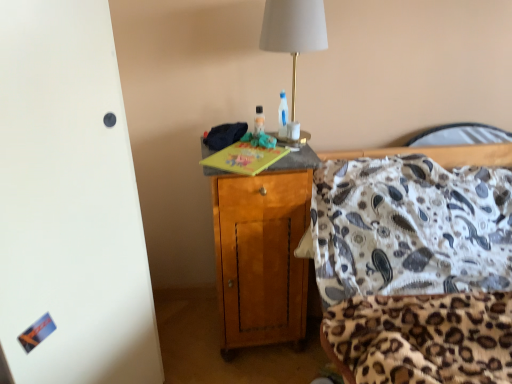
Question: From the image's perspective, would you say translucent plastic bottle at center is shown under white fabric lampshade at upper center?

Choices:
 (A) no
 (B) yes

Answer: (B)

Question: Is translucent plastic bottle at center far from white fabric lampshade at upper center?

Choices:
 (A) no
 (B) yes

Answer: (A)

Question: Does translucent plastic bottle at center have a greater width compared to white fabric lampshade at upper center?

Choices:
 (A) yes
 (B) no

Answer: (B)

Question: Considering the relative sizes of translucent plastic bottle at center and white fabric lampshade at upper center in the image provided, is translucent plastic bottle at center shorter than white fabric lampshade at upper center?

Choices:
 (A) no
 (B) yes

Answer: (B)

Question: Is translucent plastic bottle at center facing towards white fabric lampshade at upper center?

Choices:
 (A) yes
 (B) no

Answer: (A)

Question: Considering the relative positions of translucent plastic bottle at center and white fabric lampshade at upper center in the image provided, is translucent plastic bottle at center to the right of white fabric lampshade at upper center from the viewer's perspective?

Choices:
 (A) yes
 (B) no

Answer: (B)

Question: Is wooden cabinet at center oriented away from translucent plastic bottle at center?

Choices:
 (A) yes
 (B) no

Answer: (B)

Question: Does wooden cabinet at center have a lesser height compared to translucent plastic bottle at center?

Choices:
 (A) yes
 (B) no

Answer: (B)

Question: Is wooden cabinet at center far from translucent plastic bottle at center?

Choices:
 (A) yes
 (B) no

Answer: (B)

Question: Can you confirm if wooden cabinet at center is positioned to the left of translucent plastic bottle at center?

Choices:
 (A) no
 (B) yes

Answer: (B)

Question: Is wooden cabinet at center directly adjacent to translucent plastic bottle at center?

Choices:
 (A) yes
 (B) no

Answer: (B)

Question: Is wooden cabinet at center outside of translucent plastic bottle at center?

Choices:
 (A) no
 (B) yes

Answer: (B)

Question: Does white fabric lampshade at upper center have a greater width compared to wooden cabinet at center?

Choices:
 (A) no
 (B) yes

Answer: (A)